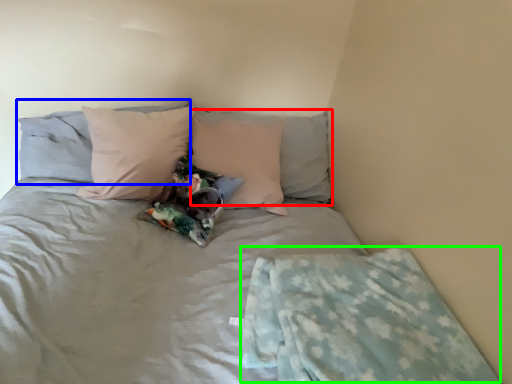
Question: Considering the real-world distances, which object is closest to pillow (highlighted by a red box)? pillow (highlighted by a blue box) or blanket (highlighted by a green box).

Choices:
 (A) pillow
 (B) blanket

Answer: (A)